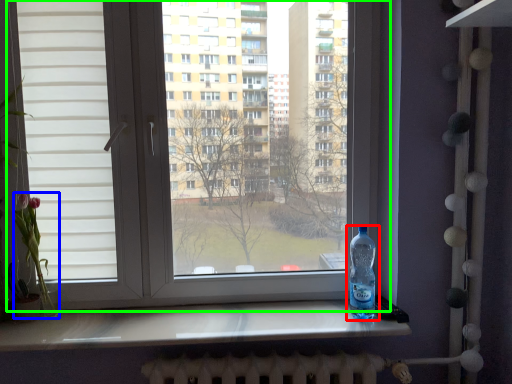
Question: Which object is the closest to the bottle (highlighted by a red box)? Choose among these: flower (highlighted by a blue box) or window (highlighted by a green box).

Choices:
 (A) flower
 (B) window

Answer: (B)